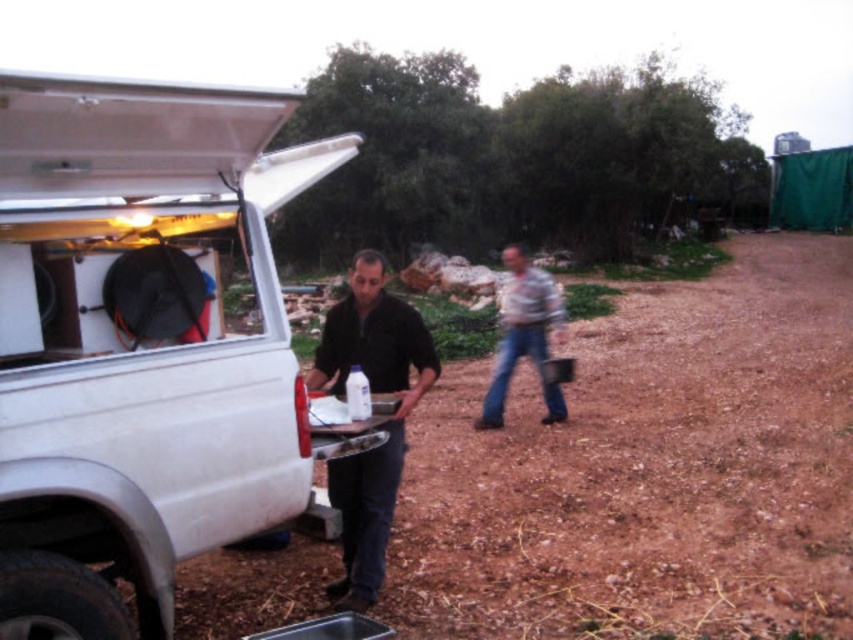
Who is taller, white matte van at center or black matte shirt at center?

Standing taller between the two is black matte shirt at center.

Can you confirm if white matte van at center is positioned below black matte shirt at center?

Actually, white matte van at center is above black matte shirt at center.

Identify the location of white matte van at center. The width and height of the screenshot is (853, 640). (140, 340).

Where is `white matte van at center`? Image resolution: width=853 pixels, height=640 pixels. white matte van at center is located at coordinates (140, 340).

Who is lower down, brown dirt field at center or light gray textured shirt at center?

brown dirt field at center

Can you confirm if brown dirt field at center is positioned below light gray textured shirt at center?

Correct, brown dirt field at center is located below light gray textured shirt at center.

Does point (746, 564) come behind point (514, 262)?

No, (746, 564) is closer to viewer.

Locate an element on the screen. brown dirt field at center is located at coordinates (648, 468).

From the picture: Is black matte shirt at center wider than light gray textured shirt at center?

In fact, black matte shirt at center might be narrower than light gray textured shirt at center.

Who is more forward, (363, 333) or (523, 305)?

Point (363, 333)

Locate an element on the screen. This screenshot has height=640, width=853. black matte shirt at center is located at coordinates (384, 426).